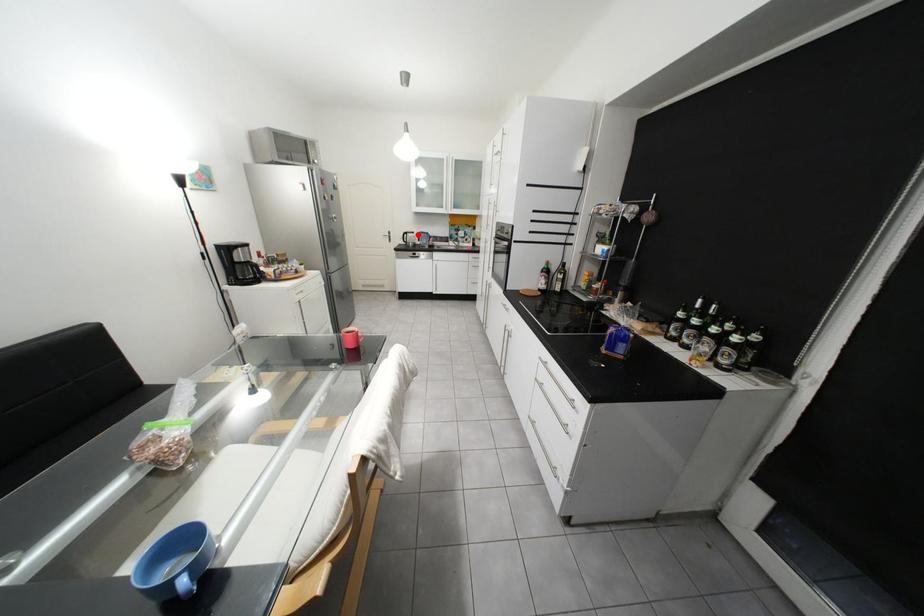
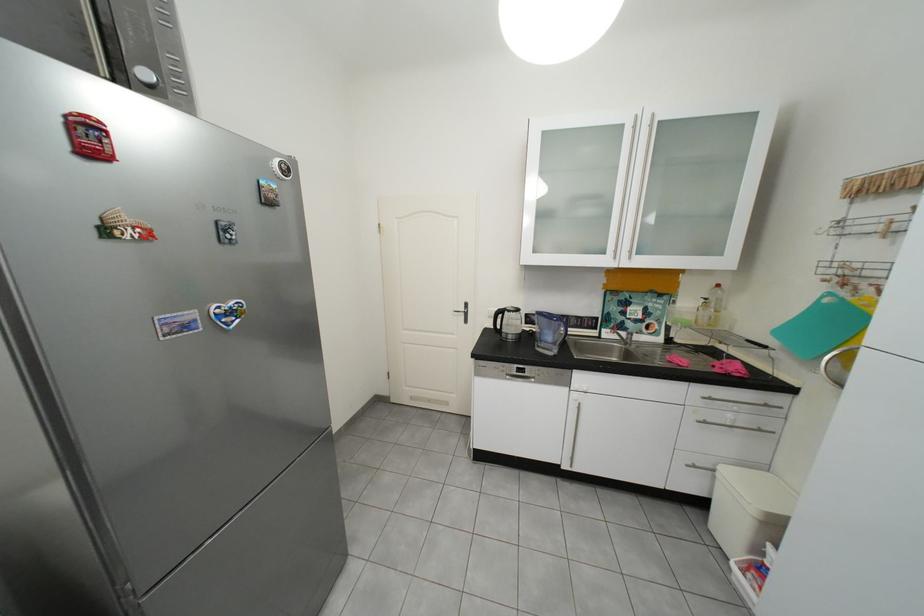
Question: I am providing you with two images of the same scene from different viewpoints. Image1 has a red point marked. In image2, the corresponding 3D location appears at what relative position? Reply with the corresponding letter.

Choices:
 (A) Closer
 (B) Farther

Answer: (B)